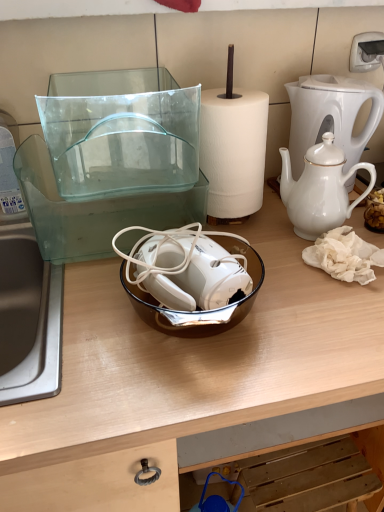
What are the coordinates of `vacant area that is in front of white porcelain teapot at right` in the screenshot? It's located at (317, 298).